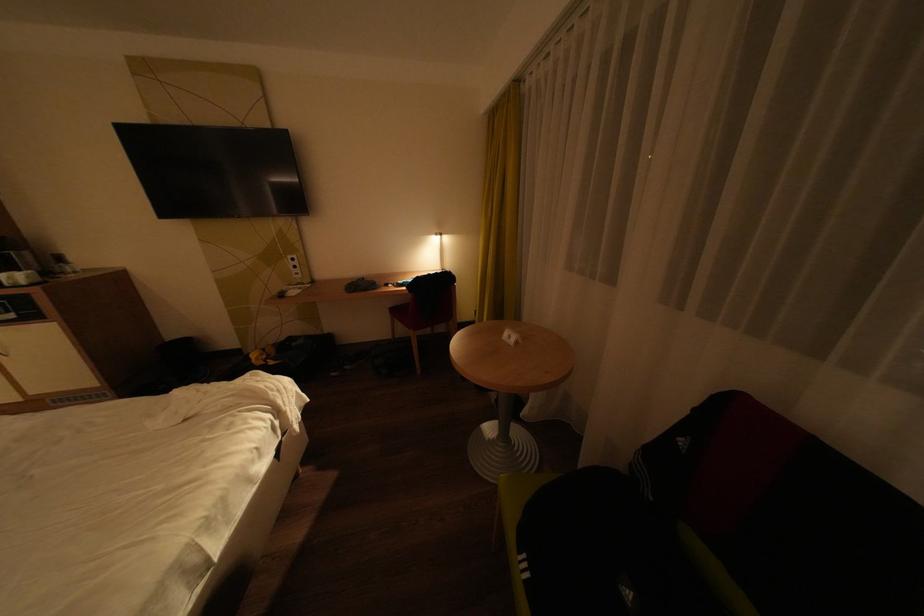
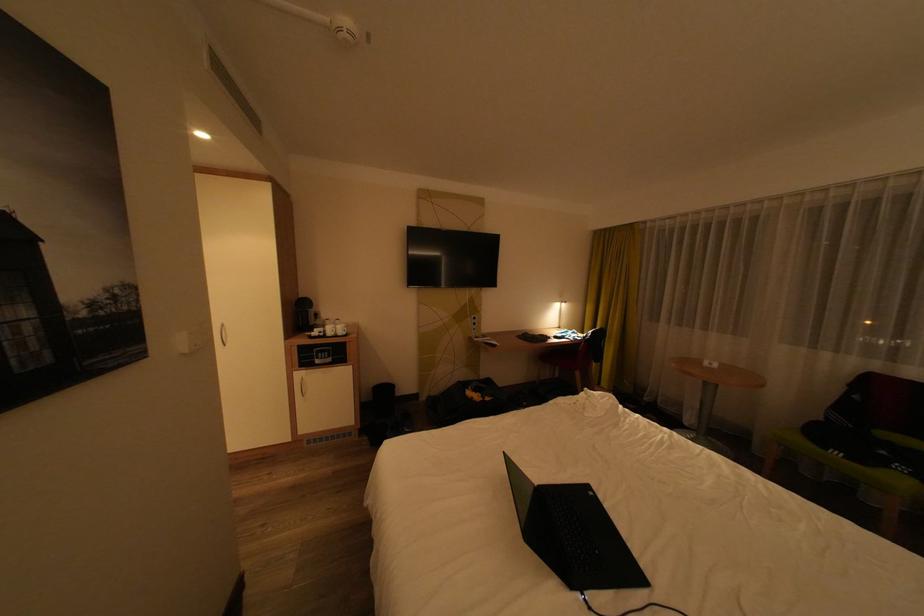
Question: The images are taken continuously from a first-person perspective. In which direction are you moving?

Choices:
 (A) Left
 (B) Right
 (C) Forward
 (D) Backward

Answer: (A)